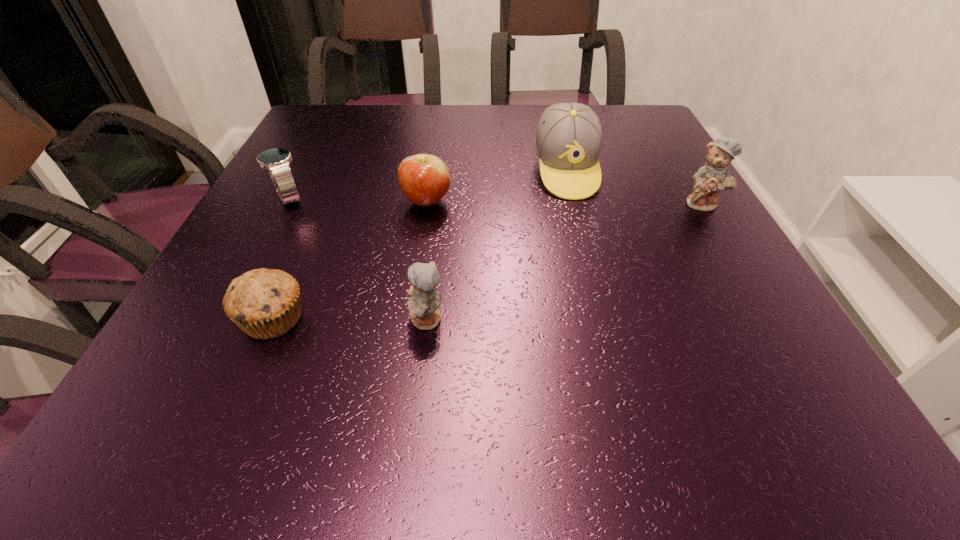
Please mark a free spot for a new teddy_bear to balance the arrangement. Please provide its 2D coordinates. Your answer should be formatted as a tuple, i.e. [(x, y)], where the tuple contains the x and y coordinates of a point satisfying the conditions above.

[(584, 254)]